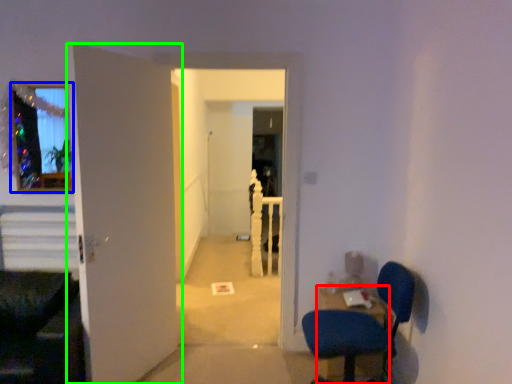
Question: Which object is the closest to the table (highlighted by a red box)? Choose among these: glass window (highlighted by a blue box) or door (highlighted by a green box).

Choices:
 (A) glass window
 (B) door

Answer: (B)